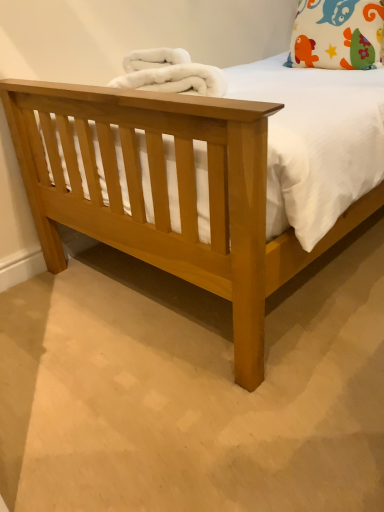
Identify the location of white fluffy blanket at upper center. The width and height of the screenshot is (384, 512). (169, 73).

Image resolution: width=384 pixels, height=512 pixels. What do you see at coordinates (169, 73) in the screenshot?
I see `white fluffy blanket at upper center` at bounding box center [169, 73].

Describe the element at coordinates (336, 34) in the screenshot. The height and width of the screenshot is (512, 384). I see `white fabric pillow with colorful patterns at upper right` at that location.

Image resolution: width=384 pixels, height=512 pixels. Identify the location of white fabric pillow with colorful patterns at upper right. (336, 34).

Where is `white fluffy blanket at upper center`? Image resolution: width=384 pixels, height=512 pixels. white fluffy blanket at upper center is located at coordinates (169, 73).

Does white fabric pillow with colorful patterns at upper right appear on the right side of white fluffy blanket at upper center?

Indeed, white fabric pillow with colorful patterns at upper right is positioned on the right side of white fluffy blanket at upper center.

Is the depth of white fabric pillow with colorful patterns at upper right less than that of white fluffy blanket at upper center?

No, white fabric pillow with colorful patterns at upper right is further to the viewer.

Does point (351, 6) appear closer or farther from the camera than point (167, 58)?

Clearly, point (351, 6) is more distant from the camera than point (167, 58).

From the image's perspective, is white fabric pillow with colorful patterns at upper right above white fluffy blanket at upper center?

Correct, white fabric pillow with colorful patterns at upper right appears higher than white fluffy blanket at upper center in the image.

From a real-world perspective, is white fabric pillow with colorful patterns at upper right beneath white fluffy blanket at upper center?

No.

Can you confirm if white fabric pillow with colorful patterns at upper right is wider than white fluffy blanket at upper center?

No.

Is white fabric pillow with colorful patterns at upper right taller than white fluffy blanket at upper center?

Indeed, white fabric pillow with colorful patterns at upper right has a greater height compared to white fluffy blanket at upper center.

Can you confirm if white fabric pillow with colorful patterns at upper right is bigger than white fluffy blanket at upper center?

Correct, white fabric pillow with colorful patterns at upper right is larger in size than white fluffy blanket at upper center.

Is white fabric pillow with colorful patterns at upper right located outside white fluffy blanket at upper center?

Indeed, white fabric pillow with colorful patterns at upper right is completely outside white fluffy blanket at upper center.

Would you consider white fabric pillow with colorful patterns at upper right to be distant from white fluffy blanket at upper center?

No, there isn't a large distance between white fabric pillow with colorful patterns at upper right and white fluffy blanket at upper center.

Does white fabric pillow with colorful patterns at upper right turn towards white fluffy blanket at upper center?

Yes, white fabric pillow with colorful patterns at upper right is facing white fluffy blanket at upper center.

What's the angular difference between white fabric pillow with colorful patterns at upper right and white fluffy blanket at upper center's facing directions?

The facing directions of white fabric pillow with colorful patterns at upper right and white fluffy blanket at upper center are 35.5 degrees apart.

Measure the distance between white fabric pillow with colorful patterns at upper right and white fluffy blanket at upper center.

white fabric pillow with colorful patterns at upper right is 86.48 centimeters from white fluffy blanket at upper center.

Locate an element on the screen. material that appears below the white fabric pillow with colorful patterns at upper right (from the image's perspective) is located at coordinates point(169,73).

Which object is positioned more to the right, white fluffy blanket at upper center or white fabric pillow with colorful patterns at upper right?

Positioned to the right is white fabric pillow with colorful patterns at upper right.

Is the position of white fluffy blanket at upper center more distant than that of white fabric pillow with colorful patterns at upper right?

No, it is not.

Is point (183, 75) positioned after point (307, 9)?

No, (183, 75) is in front of (307, 9).

From the image's perspective, is white fluffy blanket at upper center located above white fabric pillow with colorful patterns at upper right?

Incorrect, from the image's perspective, white fluffy blanket at upper center is lower than white fabric pillow with colorful patterns at upper right.

From a real-world perspective, is white fluffy blanket at upper center located beneath white fabric pillow with colorful patterns at upper right?

Yes, from a real-world perspective, white fluffy blanket at upper center is below white fabric pillow with colorful patterns at upper right.

Which object is thinner, white fluffy blanket at upper center or white fabric pillow with colorful patterns at upper right?

white fabric pillow with colorful patterns at upper right.

Does white fluffy blanket at upper center have a lesser height compared to white fabric pillow with colorful patterns at upper right?

Correct, white fluffy blanket at upper center is not as tall as white fabric pillow with colorful patterns at upper right.

In the scene shown: Does white fluffy blanket at upper center have a smaller size compared to white fabric pillow with colorful patterns at upper right?

Indeed, white fluffy blanket at upper center has a smaller size compared to white fabric pillow with colorful patterns at upper right.

Is white fluffy blanket at upper center inside the boundaries of white fabric pillow with colorful patterns at upper right, or outside?

white fluffy blanket at upper center cannot be found inside white fabric pillow with colorful patterns at upper right.

Is white fluffy blanket at upper center in contact with white fabric pillow with colorful patterns at upper right?

white fluffy blanket at upper center and white fabric pillow with colorful patterns at upper right are clearly separated.

Is white fluffy blanket at upper center positioned with its back to white fabric pillow with colorful patterns at upper right?

white fluffy blanket at upper center does not have its back to white fabric pillow with colorful patterns at upper right.

Measure the distance between white fluffy blanket at upper center and white fabric pillow with colorful patterns at upper right.

white fluffy blanket at upper center is 86.48 centimeters away from white fabric pillow with colorful patterns at upper right.

The image size is (384, 512). Find the location of `material on the left of the white fabric pillow with colorful patterns at upper right`. material on the left of the white fabric pillow with colorful patterns at upper right is located at coordinates (169, 73).

The image size is (384, 512). There is a white fluffy blanket at upper center. What are the coordinates of `pillow above it (from a real-world perspective)` in the screenshot? It's located at (336, 34).

Image resolution: width=384 pixels, height=512 pixels. I want to click on material in front of the white fabric pillow with colorful patterns at upper right, so click(x=169, y=73).